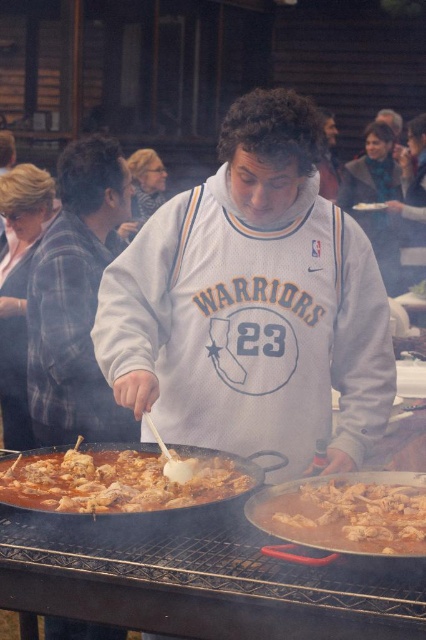
You are a photographer trying to capture a closeup of the brown matte chicken at lower left without including the plaid fabric shirt at left in the frame. Given their relative widths, is this possible?

The plaid fabric shirt at left has a lesser width compared to brown matte chicken at lower left. Therefore, it is possible to frame the brown matte chicken at lower left without including the plaid fabric shirt at left, as the shirt is narrower and can be positioned outside the camera frame.

You are standing in the outdoor cooking area and need to place a new ingredient container. The container requires a space that is not occupied by the plaid fabric shirt at left. Where should you place it?

The plaid fabric shirt at left is located at point (75, 300), so you should place the container in an area not overlapping with that coordinate.